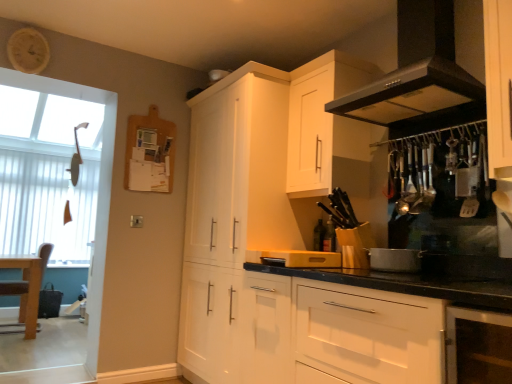
This screenshot has width=512, height=384. In order to click on white vertical blinds at left in this screenshot , I will do `click(47, 201)`.

At what (x,y) coordinates should I click in order to perform the action: click on wooden tray at center, marked as the first appliance in a left-to-right arrangement. Please return your answer as a coordinate pair (x, y). Looking at the image, I should click on (306, 258).

The height and width of the screenshot is (384, 512). I want to click on black matte exhaust hood at upper right, so [x=416, y=70].

Where is `silver metallic pot at center, the 2th appliance in the left-to-right sequence`? silver metallic pot at center, the 2th appliance in the left-to-right sequence is located at coordinates (395, 260).

What is the approximate width of white glossy cabinet at upper right, the second cabinetry viewed from the front?

white glossy cabinet at upper right, the second cabinetry viewed from the front, is 13.16 inches in width.

The height and width of the screenshot is (384, 512). In order to click on brown wooden chair at left in this screenshot , I will do `click(44, 257)`.

What is the approximate width of brown wooden chair at left?

brown wooden chair at left is 53.77 centimeters wide.

In order to click on white glossy cabinet at upper center, the first cabinetry in the back-to-front sequence in this screenshot , I will do pyautogui.click(x=231, y=214).

Is brown wooden chair at left far from black matte exhaust hood at upper right?

Yes, brown wooden chair at left and black matte exhaust hood at upper right are quite far apart.

Is black matte exhaust hood at upper right at the back of brown wooden chair at left?

That's not correct — brown wooden chair at left is not looking away from black matte exhaust hood at upper right.

Where is `exhaust hood above the brown wooden chair at left (from the image's perspective)`? exhaust hood above the brown wooden chair at left (from the image's perspective) is located at coordinates (416, 70).

Who is shorter, wooden tray at center, which is the 2th appliance from right to left, or white glossy cabinet at upper right, the second cabinetry viewed from the front?

wooden tray at center, which is the 2th appliance from right to left, is shorter.

Locate an element on the screen. The image size is (512, 384). appliance on the left of white glossy cabinet at upper right, the 2th cabinetry from the back is located at coordinates (306, 258).

From the image's perspective, between wooden tray at center, which is the 2th appliance from right to left, and white glossy cabinet at upper right, the second cabinetry viewed from the front, who is located below?

wooden tray at center, which is the 2th appliance from right to left.

Is wooden tray at center, which is the 2th appliance from right to left, looking in the opposite direction of white glossy cabinet at upper right, the 2th cabinetry from the back?

No, wooden tray at center, which is the 2th appliance from right to left,'s orientation is not away from white glossy cabinet at upper right, the 2th cabinetry from the back.

From the image's perspective, which one is positioned higher, black matte exhaust hood at upper right or wooden tray at center, which is the 2th appliance from right to left?

From the image's view, black matte exhaust hood at upper right is above.

Is black matte exhaust hood at upper right looking in the opposite direction of wooden tray at center, which is the 2th appliance from right to left?

No, wooden tray at center, which is the 2th appliance from right to left, is not at the back of black matte exhaust hood at upper right.

The height and width of the screenshot is (384, 512). What are the coordinates of `exhaust hood above the wooden tray at center, marked as the first appliance in a left-to-right arrangement (from a real-world perspective)` in the screenshot? It's located at (416, 70).

Between black matte exhaust hood at upper right and white glossy cabinet at upper right, the 2th cabinetry from the back, which one appears on the left side from the viewer's perspective?

white glossy cabinet at upper right, the 2th cabinetry from the back, is more to the left.

The width and height of the screenshot is (512, 384). I want to click on exhaust hood above the white glossy cabinet at upper right, the 2th cabinetry from the back (from a real-world perspective), so click(416, 70).

In terms of size, does black matte exhaust hood at upper right appear bigger or smaller than white glossy cabinet at upper right, the second cabinetry viewed from the front?

Clearly, black matte exhaust hood at upper right is larger in size than white glossy cabinet at upper right, the second cabinetry viewed from the front.

Considering the relative sizes of black matte exhaust hood at upper right and white glossy cabinet at upper right, the second cabinetry viewed from the front, in the image provided, is black matte exhaust hood at upper right wider than white glossy cabinet at upper right, the second cabinetry viewed from the front,?

Indeed, black matte exhaust hood at upper right has a greater width compared to white glossy cabinet at upper right, the second cabinetry viewed from the front.

Who is shorter, silver metallic pot at center, positioned as the first appliance in right-to-left order, or white matte cabinet at lower center, the first cabinetry when ordered from front to back?

With less height is silver metallic pot at center, positioned as the first appliance in right-to-left order.

Between silver metallic pot at center, the 2th appliance in the left-to-right sequence, and white matte cabinet at lower center, the first cabinetry when ordered from front to back, which one appears on the right side from the viewer's perspective?

Positioned to the right is silver metallic pot at center, the 2th appliance in the left-to-right sequence.

From a real-world perspective, does silver metallic pot at center, positioned as the first appliance in right-to-left order, stand above white matte cabinet at lower center, the first cabinetry when ordered from front to back?

Yes, from a real-world perspective, silver metallic pot at center, positioned as the first appliance in right-to-left order, is above white matte cabinet at lower center, the first cabinetry when ordered from front to back.

This screenshot has width=512, height=384. What are the coordinates of `appliance on the right of white matte cabinet at lower center, the first cabinetry when ordered from front to back` in the screenshot? It's located at (395, 260).

In terms of size, does white glossy cabinet at upper right, the 2th cabinetry from the back, appear bigger or smaller than silver metallic pot at center, positioned as the first appliance in right-to-left order?

Clearly, white glossy cabinet at upper right, the 2th cabinetry from the back, is larger in size than silver metallic pot at center, positioned as the first appliance in right-to-left order.

From the picture: Considering the relative sizes of white glossy cabinet at upper right, the 2th cabinetry from the back, and silver metallic pot at center, the 2th appliance in the left-to-right sequence, in the image provided, is white glossy cabinet at upper right, the 2th cabinetry from the back, thinner than silver metallic pot at center, the 2th appliance in the left-to-right sequence,?

Incorrect, the width of white glossy cabinet at upper right, the 2th cabinetry from the back, is not less than that of silver metallic pot at center, the 2th appliance in the left-to-right sequence.

Which is in front, white glossy cabinet at upper right, the 2th cabinetry from the back, or silver metallic pot at center, the 2th appliance in the left-to-right sequence?

silver metallic pot at center, the 2th appliance in the left-to-right sequence, is more forward.

Locate an element on the screen. Image resolution: width=512 pixels, height=384 pixels. appliance on the right of white glossy cabinet at upper right, the 2th cabinetry from the back is located at coordinates (395, 260).

Is white glossy cabinet at upper center, positioned as the 3th cabinetry in front-to-back order, positioned far away from white vertical blinds at left?

Yes.

Could you measure the distance between white glossy cabinet at upper center, positioned as the 3th cabinetry in front-to-back order, and white vertical blinds at left?

The distance of white glossy cabinet at upper center, positioned as the 3th cabinetry in front-to-back order, from white vertical blinds at left is 3.15 meters.

Who is taller, white glossy cabinet at upper center, positioned as the 3th cabinetry in front-to-back order, or white vertical blinds at left?

white glossy cabinet at upper center, positioned as the 3th cabinetry in front-to-back order, is taller.

Is point (242, 82) behind point (38, 195)?

No, (242, 82) is in front of (38, 195).

The width and height of the screenshot is (512, 384). In order to click on chair that appears below the black matte exhaust hood at upper right (from the image's perspective) in this screenshot , I will do `click(44, 257)`.

You are a GUI agent. You are given a task and a screenshot of the screen. Output one action in this format:
    pyautogui.click(x=<x>, y=<y>)
    Task: Click on the 1st cabinetry behind the wooden tray at center, which is the 2th appliance from right to left, counting from the anchor's position
    The height and width of the screenshot is (384, 512).
    Given the screenshot: What is the action you would take?
    pyautogui.click(x=326, y=126)

Which object lies further to the anchor point white matte cabinet at lower center, positioned as the 3th cabinetry in back-to-front order, white glossy cabinet at upper center, positioned as the 3th cabinetry in front-to-back order, or black matte exhaust hood at upper right?

Based on the image, black matte exhaust hood at upper right appears to be further to white matte cabinet at lower center, positioned as the 3th cabinetry in back-to-front order.

Based on their spatial positions, is wooden tray at center, marked as the first appliance in a left-to-right arrangement, or white glossy cabinet at upper center, positioned as the 3th cabinetry in front-to-back order, further from white vertical blinds at left?

The object further to white vertical blinds at left is wooden tray at center, marked as the first appliance in a left-to-right arrangement.

When comparing their distances from black matte exhaust hood at upper right, does white vertical blinds at left or brown wooden chair at left seem closer?

brown wooden chair at left is positioned closer to the anchor black matte exhaust hood at upper right.

Looking at the image, which one is located closer to white vertical blinds at left, white glossy cabinet at upper center, positioned as the 3th cabinetry in front-to-back order, or white matte cabinet at lower center, the first cabinetry when ordered from front to back?

white glossy cabinet at upper center, positioned as the 3th cabinetry in front-to-back order.

From the image, which object appears to be nearer to white vertical blinds at left, white glossy cabinet at upper right, the 2th cabinetry from the back, or white matte cabinet at lower center, the first cabinetry when ordered from front to back?

white glossy cabinet at upper right, the 2th cabinetry from the back, is closer to white vertical blinds at left.

From the image, which object appears to be farther from white vertical blinds at left, white glossy cabinet at upper right, the 2th cabinetry from the back, or black matte exhaust hood at upper right?

Based on the image, black matte exhaust hood at upper right appears to be further to white vertical blinds at left.

Based on their spatial positions, is wooden tray at center, marked as the first appliance in a left-to-right arrangement, or brown wooden chair at left further from white matte cabinet at lower center, the first cabinetry when ordered from front to back?

brown wooden chair at left lies further to white matte cabinet at lower center, the first cabinetry when ordered from front to back, than the other object.

Looking at the image, which one is located further to black matte exhaust hood at upper right, silver metallic pot at center, positioned as the first appliance in right-to-left order, or white glossy cabinet at upper right, the second cabinetry viewed from the front?

silver metallic pot at center, positioned as the first appliance in right-to-left order, is further to black matte exhaust hood at upper right.

This screenshot has width=512, height=384. Find the location of `appliance located between white vertical blinds at left and white glossy cabinet at upper right, the second cabinetry viewed from the front, in the left-right direction`. appliance located between white vertical blinds at left and white glossy cabinet at upper right, the second cabinetry viewed from the front, in the left-right direction is located at coordinates (306, 258).

Image resolution: width=512 pixels, height=384 pixels. I want to click on appliance situated between brown wooden chair at left and white matte cabinet at lower center, the first cabinetry when ordered from front to back, from left to right, so click(x=306, y=258).

Where is `appliance between black matte exhaust hood at upper right and wooden tray at center, which is the 2th appliance from right to left, from top to bottom`? This screenshot has height=384, width=512. appliance between black matte exhaust hood at upper right and wooden tray at center, which is the 2th appliance from right to left, from top to bottom is located at coordinates (395, 260).

The image size is (512, 384). Find the location of `appliance between white vertical blinds at left and silver metallic pot at center, the 2th appliance in the left-to-right sequence, from left to right`. appliance between white vertical blinds at left and silver metallic pot at center, the 2th appliance in the left-to-right sequence, from left to right is located at coordinates (306, 258).